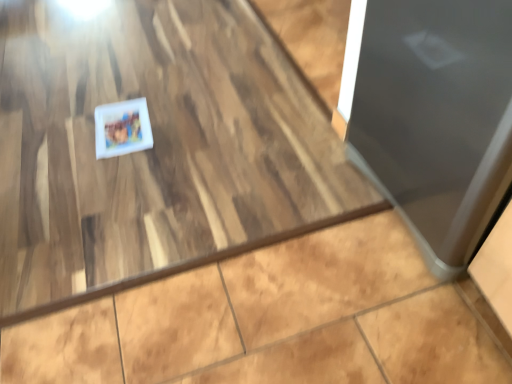
The image size is (512, 384). Identify the location of vacant area situated to the left side of glossy metallic door at right. (281, 214).